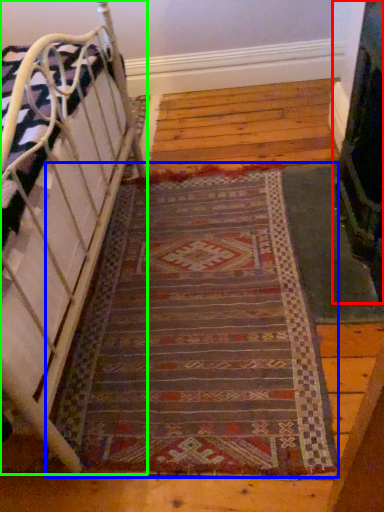
Question: Which is farther away from fireplace (highlighted by a red box)? mat (highlighted by a blue box) or furniture (highlighted by a green box)?

Choices:
 (A) mat
 (B) furniture

Answer: (B)